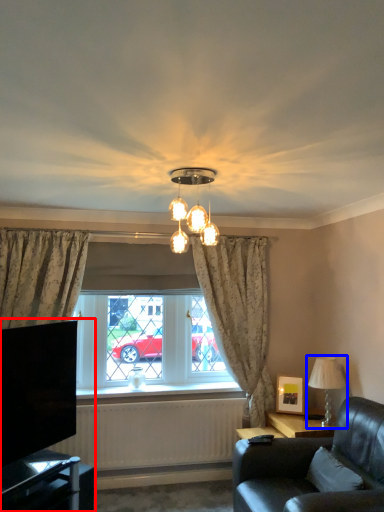
Question: Which object is further to the camera taking this photo, entertainment center (highlighted by a red box) or lamp (highlighted by a blue box)?

Choices:
 (A) entertainment center
 (B) lamp

Answer: (B)